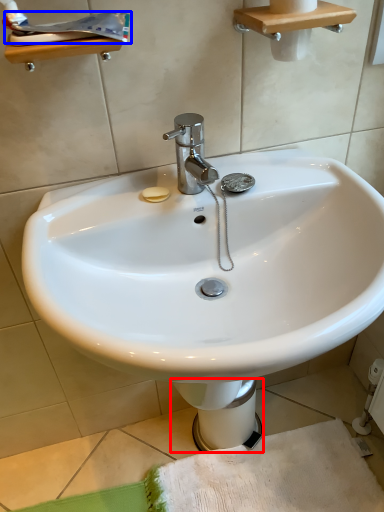
Question: Among these objects, which one is nearest to the camera, bidet (highlighted by a red box) or toothpaste (highlighted by a blue box)?

Choices:
 (A) bidet
 (B) toothpaste

Answer: (B)